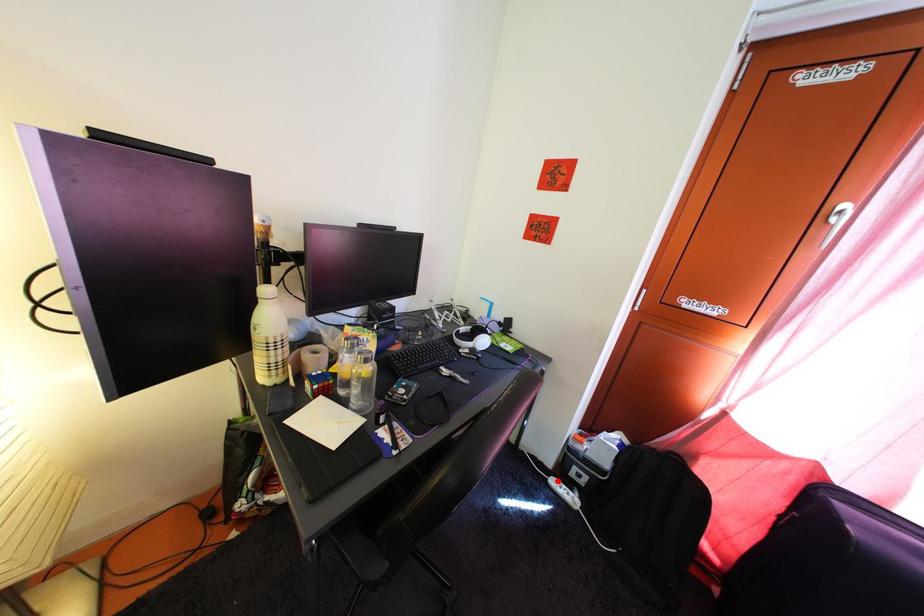
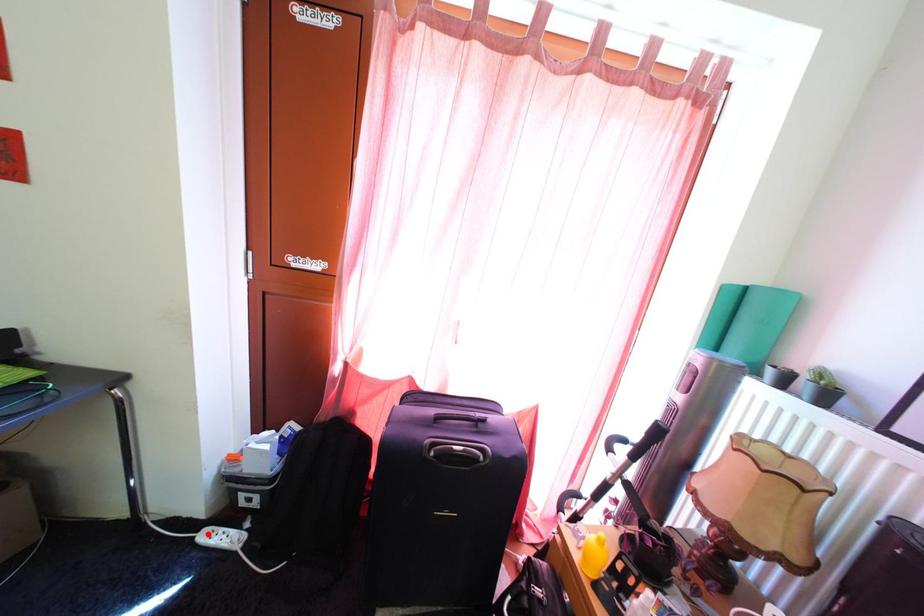
I am providing you with two images of the same scene from different viewpoints. A red point is marked on the first image and another point is marked on the second image. Is the marked point in image1 the same physical position as the marked point in image2?

Yes